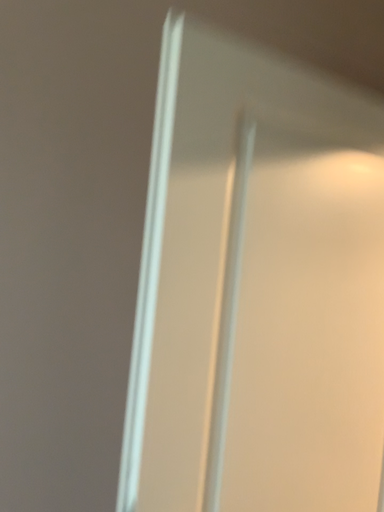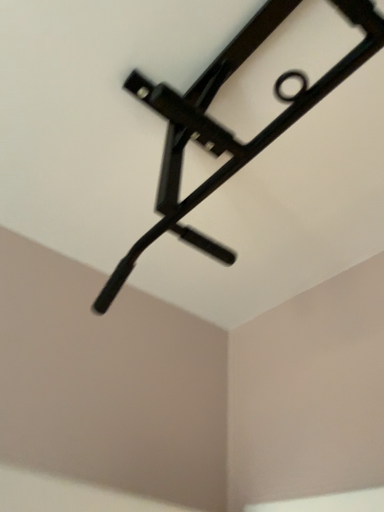
Question: Which way did the camera rotate in the video?

Choices:
 (A) rotated upward
 (B) rotated downward

Answer: (A)